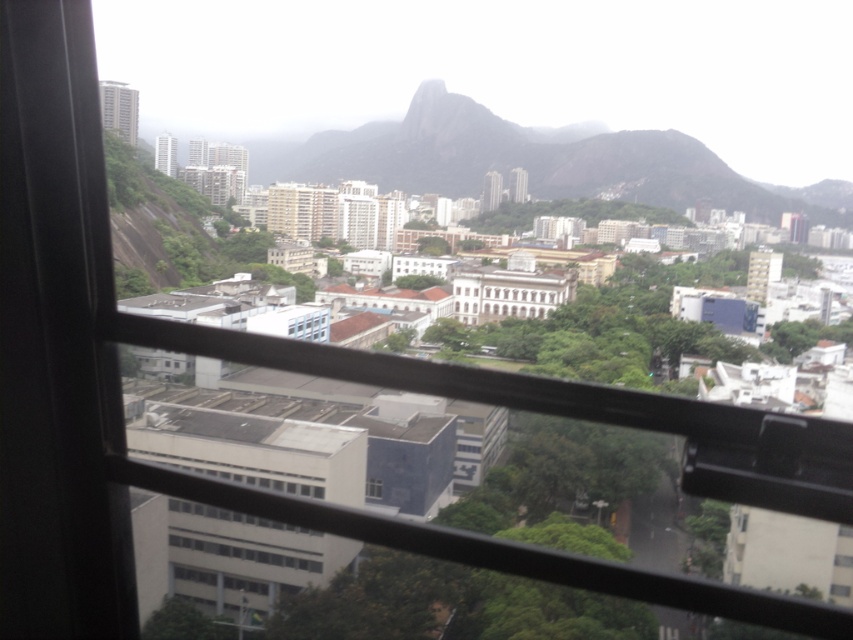
Who is higher up, transparent plastic window at center or transparent glass window at center?

Positioned higher is transparent plastic window at center.

Does transparent plastic window at center have a greater width compared to transparent glass window at center?

Correct, the width of transparent plastic window at center exceeds that of transparent glass window at center.

The height and width of the screenshot is (640, 853). What are the coordinates of `transparent plastic window at center` in the screenshot? It's located at (308, 323).